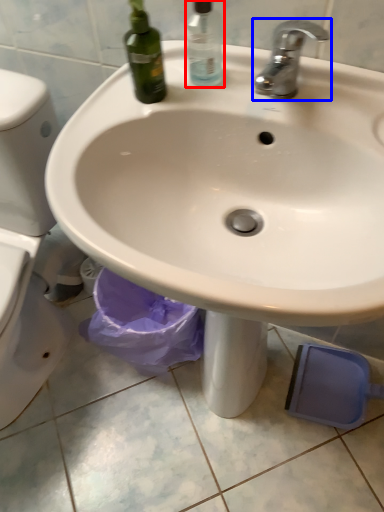
Question: Which of the following is the closest to the observer, cleaning product (highlighted by a red box) or tap (highlighted by a blue box)?

Choices:
 (A) cleaning product
 (B) tap

Answer: (B)